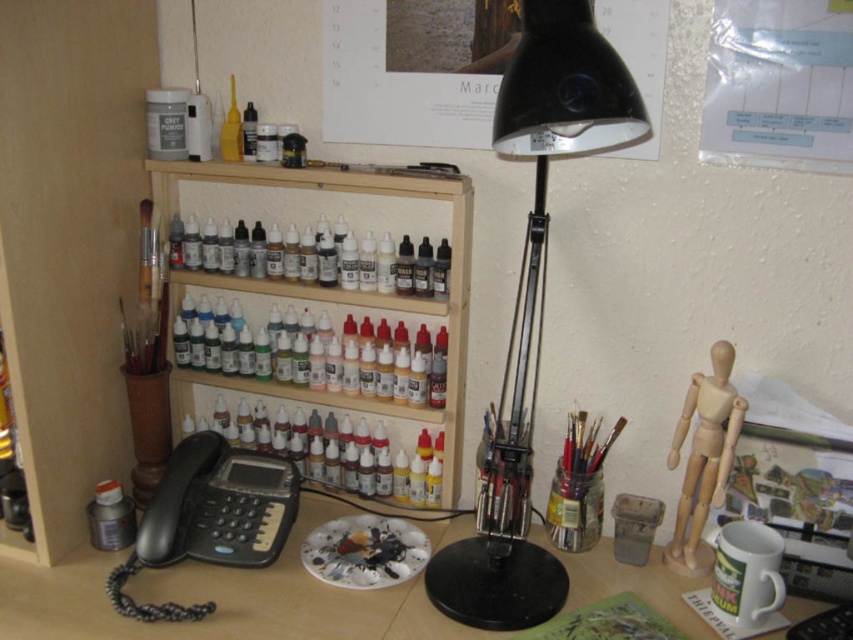
Question: Considering the relative positions of wooden shelf at center and black plastic phone at lower left in the image provided, where is wooden shelf at center located with respect to black plastic phone at lower left?

Choices:
 (A) above
 (B) below

Answer: (A)

Question: Is wooden desk at center above black plastic phone at lower left?

Choices:
 (A) yes
 (B) no

Answer: (B)

Question: Estimate the real-world distances between objects in this image. Which object is farther from the wooden shelf at center?

Choices:
 (A) black plastic table lamp at center
 (B) wooden desk at center

Answer: (B)

Question: Does black plastic table lamp at center have a lesser width compared to wooden shelf at center?

Choices:
 (A) yes
 (B) no

Answer: (A)

Question: Which object is positioned closest to the black plastic phone at lower left?

Choices:
 (A) wooden shelf at center
 (B) black plastic table lamp at center
 (C) wooden desk at center

Answer: (C)

Question: Which of these objects is positioned farthest from the black plastic table lamp at center?

Choices:
 (A) wooden shelf at center
 (B) black plastic phone at lower left

Answer: (B)